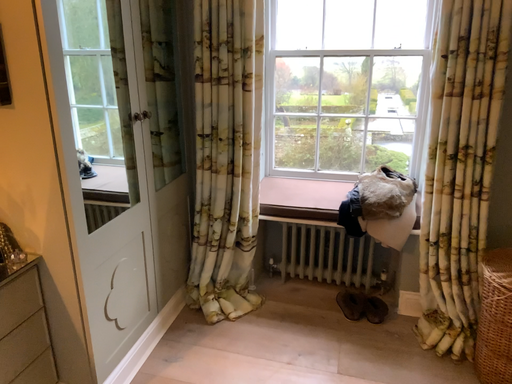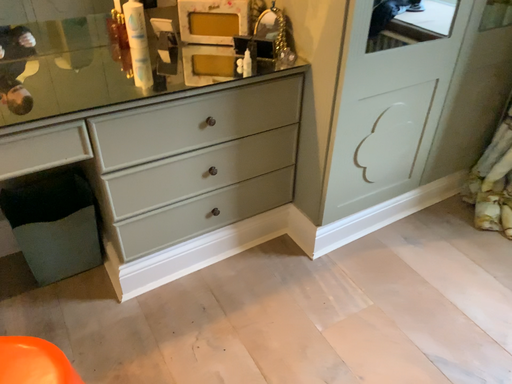
Question: How did the camera likely rotate when shooting the video?

Choices:
 (A) rotated upward
 (B) rotated downward

Answer: (B)